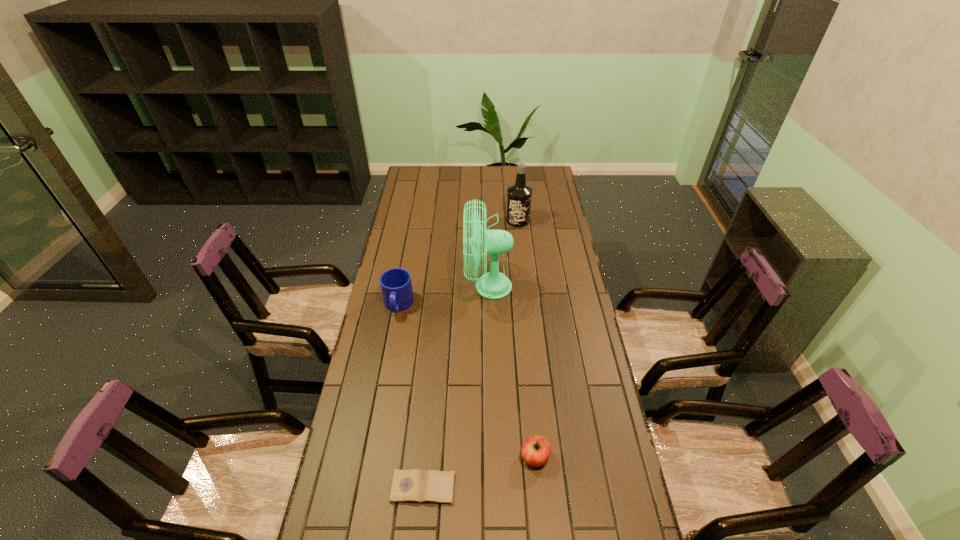
Where is `vacant space at the far left corner`? The height and width of the screenshot is (540, 960). vacant space at the far left corner is located at coordinates (408, 180).

At what (x,y) coordinates should I click in order to perform the action: click on free space at the far right corner of the desktop. Please return your answer as a coordinate pair (x, y). The height and width of the screenshot is (540, 960). Looking at the image, I should click on (552, 166).

You are a GUI agent. You are given a task and a screenshot of the screen. Output one action in this format:
    pyautogui.click(x=<x>, y=<y>)
    Task: Click on the free space between the fan and the liquor
    
    Given the screenshot: What is the action you would take?
    pyautogui.click(x=503, y=254)

Locate an element on the screen. The height and width of the screenshot is (540, 960). unoccupied area between the fan and the apple is located at coordinates (512, 372).

Where is `empty location between the tallest object and the second shortest object`? empty location between the tallest object and the second shortest object is located at coordinates (512, 372).

This screenshot has width=960, height=540. I want to click on empty location between the apple and the farthest object, so click(x=526, y=339).

Image resolution: width=960 pixels, height=540 pixels. I want to click on unoccupied area between the fourth shortest object and the shortest object, so click(470, 354).

This screenshot has width=960, height=540. Identify the location of vacant space that is in between the liquor and the apple. (526, 339).

This screenshot has height=540, width=960. What are the coordinates of `free spot between the leftmost object and the fourth object from right to left` in the screenshot? It's located at (411, 396).

Identify the location of unoccupied area between the apple and the third tallest object. The width and height of the screenshot is (960, 540). (467, 381).